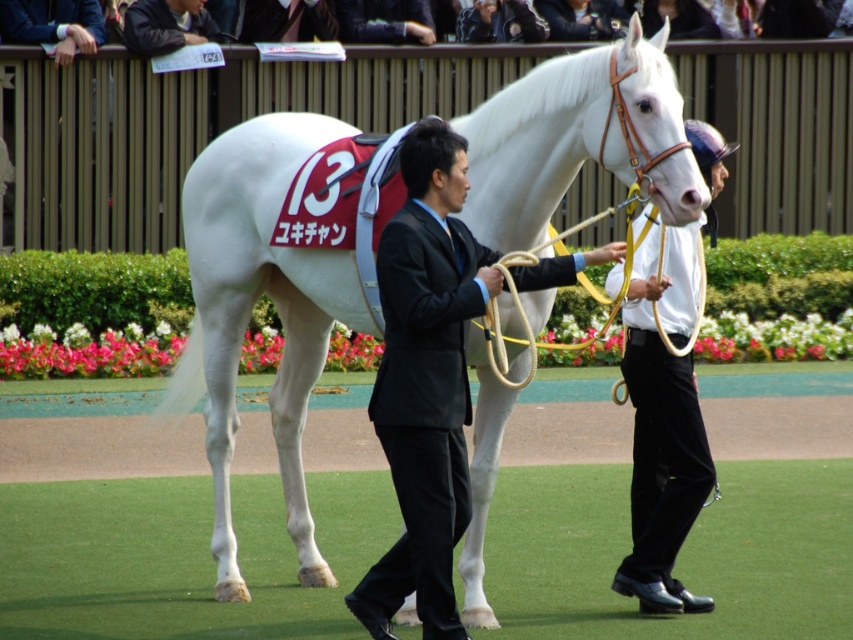
Question: Estimate the real-world distances between objects in this image. Which object is farther from the smooth black suit at upper center?

Choices:
 (A) dark brown leather jacket at upper center
 (B) dark blue suit at center
 (C) white leather helmet at upper right
 (D) white glossy horse at center

Answer: (C)

Question: Can you confirm if white leather helmet at upper right is wider than smooth black suit at upper center?

Choices:
 (A) yes
 (B) no

Answer: (B)

Question: Estimate the real-world distances between objects in this image. Which object is farther from the black leather jacket at upper center?

Choices:
 (A) white glossy horse at center
 (B) dark blue suit at center

Answer: (A)

Question: Estimate the real-world distances between objects in this image. Which object is farther from the smooth white suit at center?

Choices:
 (A) black leather jacket at upper center
 (B) smooth black suit at upper center
 (C) dark blue suit at center

Answer: (A)

Question: Does white glossy horse at center appear on the right side of dark blue suit at center?

Choices:
 (A) no
 (B) yes

Answer: (B)

Question: Is dark blue suit at center positioned behind dark brown leather jacket at upper center?

Choices:
 (A) no
 (B) yes

Answer: (A)